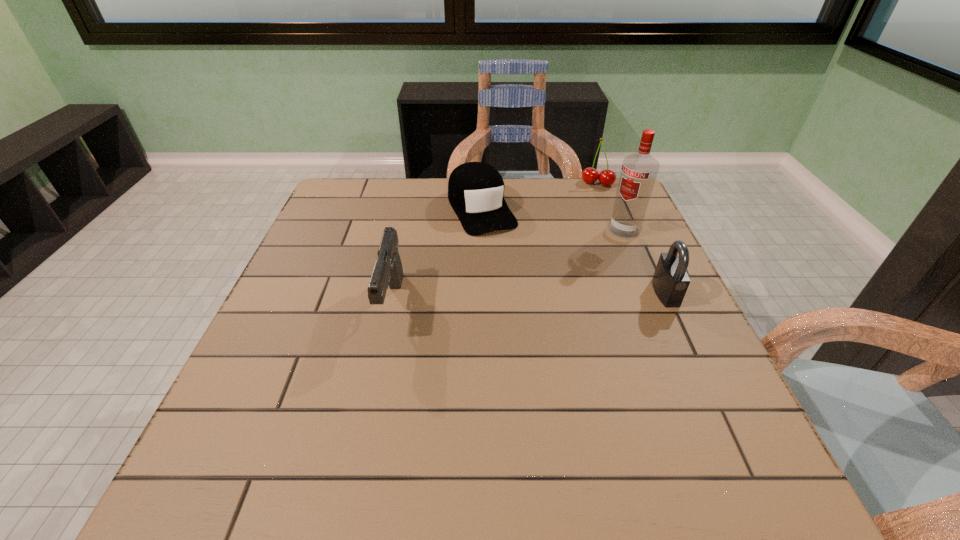
I want to click on vodka present at the right edge, so click(x=639, y=171).

You are a GUI agent. You are given a task and a screenshot of the screen. Output one action in this format:
    pyautogui.click(x=<x>, y=<y>)
    Task: Click on the cherry that is at the right edge
    This screenshot has width=960, height=540.
    Given the screenshot: What is the action you would take?
    pyautogui.click(x=590, y=175)

What are the coordinates of `vodka that is positioned at the far right corner` in the screenshot? It's located at (639, 171).

In order to click on cherry at the far right corner in this screenshot , I will do `click(590, 175)`.

Find the location of a particular element. The width and height of the screenshot is (960, 540). free space at the far edge of the desktop is located at coordinates (419, 219).

Image resolution: width=960 pixels, height=540 pixels. I want to click on vacant position at the near edge of the desktop, so click(x=452, y=399).

I want to click on free space at the left edge of the desktop, so click(356, 239).

Locate an element on the screen. This screenshot has width=960, height=540. vacant region at the right edge of the desktop is located at coordinates (644, 295).

This screenshot has width=960, height=540. Identify the location of vacant space at the far right corner of the desktop. pos(606,203).

Locate an element on the screen. Image resolution: width=960 pixels, height=540 pixels. empty space that is in between the pistol and the tallest object is located at coordinates (509, 267).